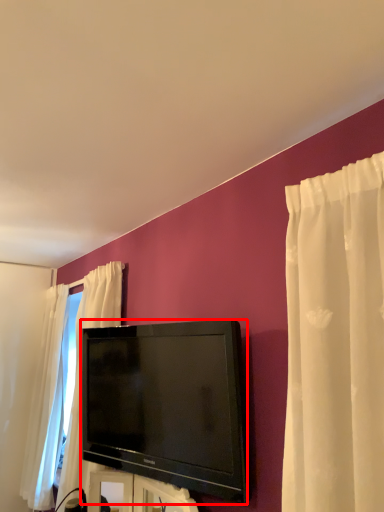
Question: From the image's perspective, what is the correct spatial positioning of television (annotated by the red box) in reference to furniture?

Choices:
 (A) below
 (B) above

Answer: (B)